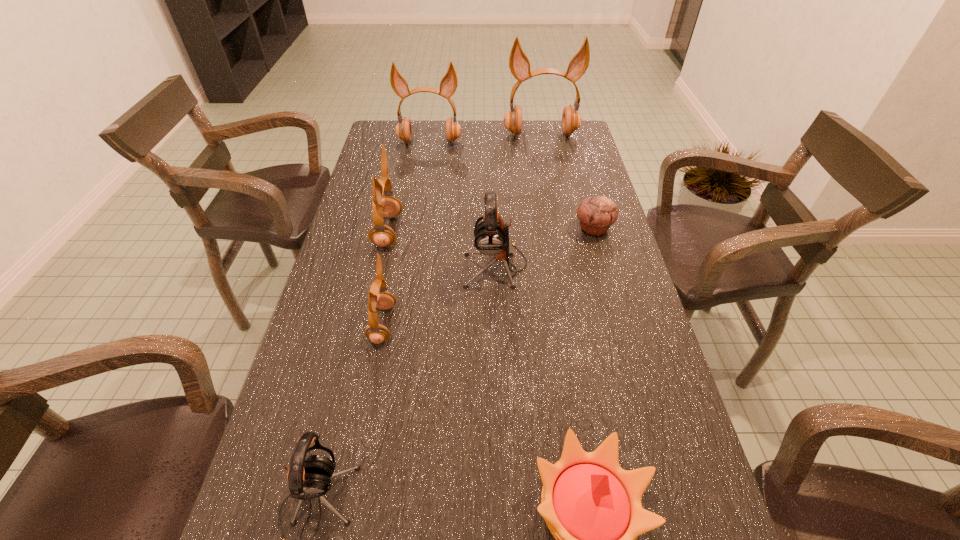
You are a GUI agent. You are given a task and a screenshot of the screen. Output one action in this format:
    pyautogui.click(x=<x>, y=<y>)
    Task: Click on the free location located 0.400m on the front-facing side of the tallest earphone
    This screenshot has height=540, width=960.
    Given the screenshot: What is the action you would take?
    pyautogui.click(x=555, y=207)

Identify the location of free space located 0.150m on the front-facing side of the second biggest brown earphone. (425, 171).

You are a GUI agent. You are given a task and a screenshot of the screen. Output one action in this format:
    pyautogui.click(x=<x>, y=<y>)
    Task: Click on the vacant space located on the left of the bigger black earphone
    
    Given the screenshot: What is the action you would take?
    pyautogui.click(x=357, y=265)

Where is `vacant space located on the front-facing side of the third farthest brown earphone`? vacant space located on the front-facing side of the third farthest brown earphone is located at coordinates (428, 231).

At what (x,y) coordinates should I click in order to perform the action: click on vacant space located 0.230m on the front-facing side of the second nearest earphone. Please return your answer as a coordinate pair (x, y). This screenshot has width=960, height=540. Looking at the image, I should click on (491, 324).

What are the coordinates of `vacant area situated 0.140m on the left of the shortest object` in the screenshot? It's located at (527, 228).

Locate an element on the screen. The height and width of the screenshot is (540, 960). earphone present at the right edge is located at coordinates (519, 64).

Find the location of a particular element. This screenshot has height=540, width=960. muffin present at the right edge is located at coordinates (596, 214).

Image resolution: width=960 pixels, height=540 pixels. What are the coordinates of `object that is at the far left corner` in the screenshot? It's located at (448, 84).

This screenshot has width=960, height=540. I want to click on object at the far right corner, so click(519, 64).